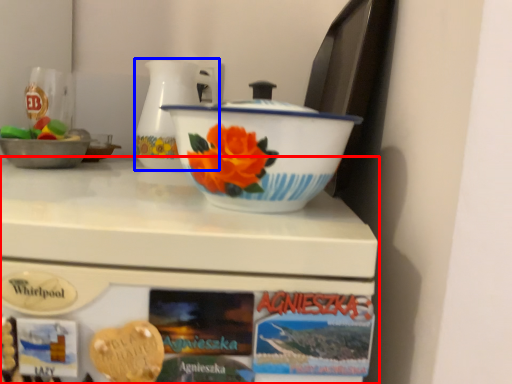
Question: Which point is closer to the camera, table (highlighted by a red box) or jug (highlighted by a blue box)?

Choices:
 (A) table
 (B) jug

Answer: (A)